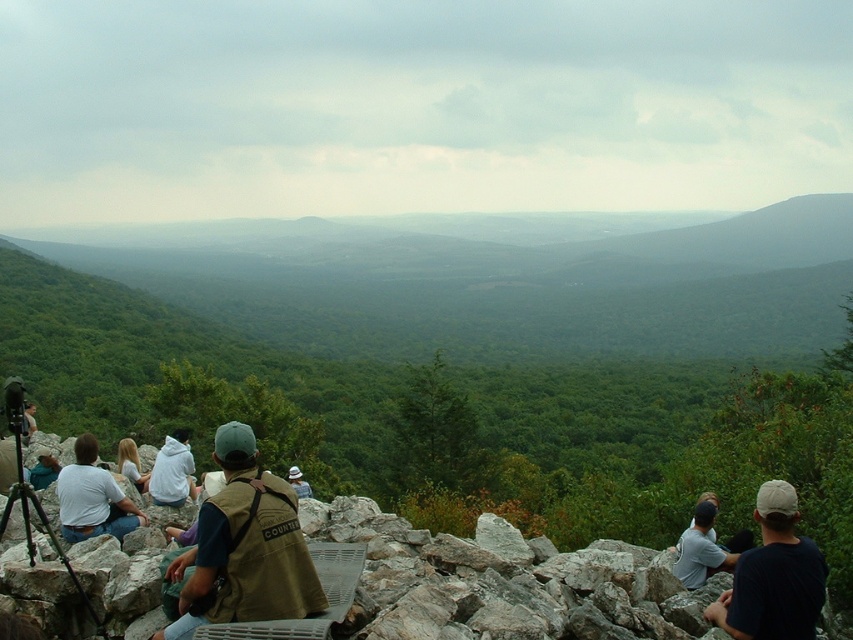
You are a hiker who wants to place a 2.5 meter long tent between the gray rock at lower left and the white hoodie at left. Is there enough space to set it up without moving either object?

The distance between the gray rock at lower left and the white hoodie at left is 5.40 meters. Since the tent is 2.5 meters long, there is sufficient space to place it between them without moving either object.